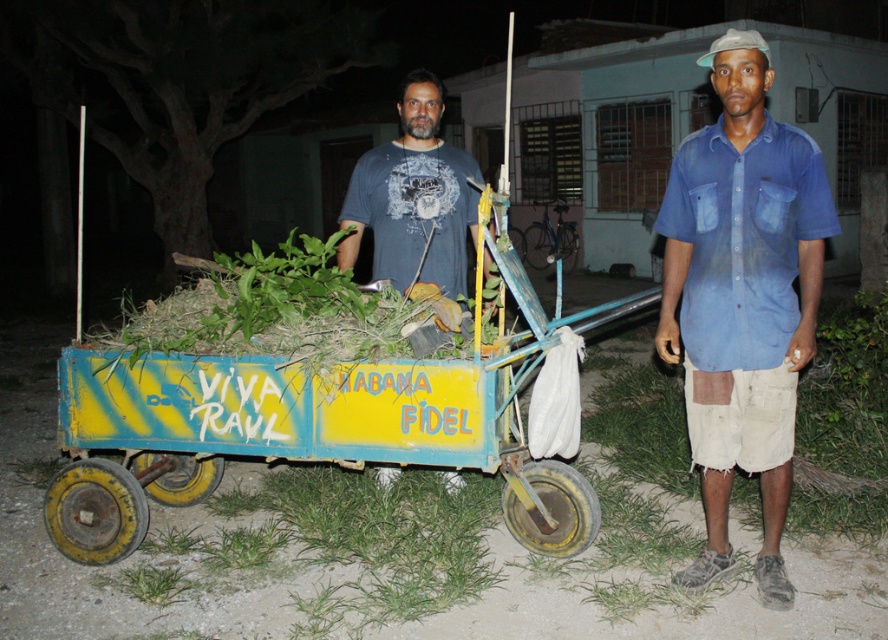
Which of these two, yellow painted wood wagon at center or blue denim shirt at center, stands shorter?

Standing shorter between the two is blue denim shirt at center.

Describe the element at coordinates (313, 417) in the screenshot. This screenshot has height=640, width=888. I see `yellow painted wood wagon at center` at that location.

You are a GUI agent. You are given a task and a screenshot of the screen. Output one action in this format:
    pyautogui.click(x=<x>, y=<y>)
    Task: Click on the yellow painted wood wagon at center
    This screenshot has height=640, width=888.
    Given the screenshot: What is the action you would take?
    pyautogui.click(x=313, y=417)

Which is more to the left, blue denim shirt at center or dark blue t-shirt at center?

From the viewer's perspective, dark blue t-shirt at center appears more on the left side.

The height and width of the screenshot is (640, 888). What do you see at coordinates (742, 298) in the screenshot?
I see `blue denim shirt at center` at bounding box center [742, 298].

Which is behind, point (774, 300) or point (391, 179)?

Positioned behind is point (391, 179).

Identify the location of blue denim shirt at center. The height and width of the screenshot is (640, 888). (742, 298).

Who is positioned more to the right, yellow painted wood wagon at center or dark blue t-shirt at center?

From the viewer's perspective, dark blue t-shirt at center appears more on the right side.

Identify the location of yellow painted wood wagon at center. (313, 417).

Identify the location of yellow painted wood wagon at center. This screenshot has width=888, height=640. (313, 417).